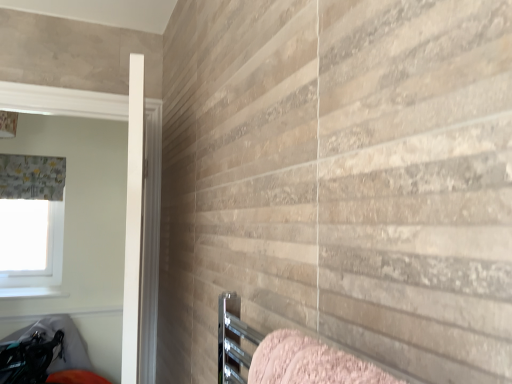
Question: Relative to textured gray curtain at left, is white smooth door at left in front or behind?

Choices:
 (A) front
 (B) behind

Answer: (A)

Question: From the image's perspective, is white smooth door at left positioned above or below textured gray curtain at left?

Choices:
 (A) below
 (B) above

Answer: (A)

Question: Which object is positioned closest to the pink textured towel at lower right?

Choices:
 (A) textured gray curtain at left
 (B) white fabric at upper left
 (C) white glossy window sill at lower left
 (D) white smooth door at left

Answer: (D)

Question: Estimate the real-world distances between objects in this image. Which object is closer to the textured gray curtain at left?

Choices:
 (A) white fabric at upper left
 (B) white glossy window sill at lower left
 (C) white smooth door at left
 (D) pink textured towel at lower right

Answer: (A)